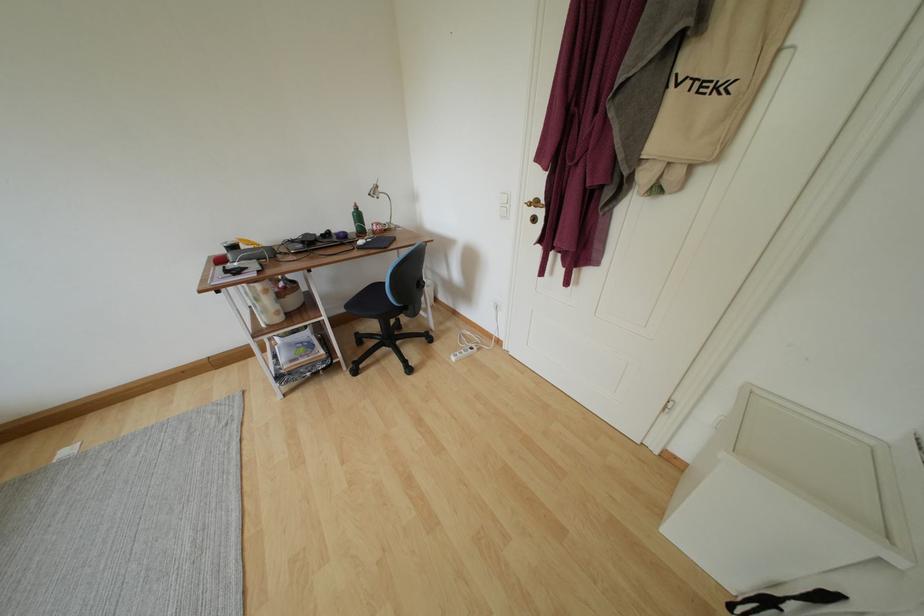
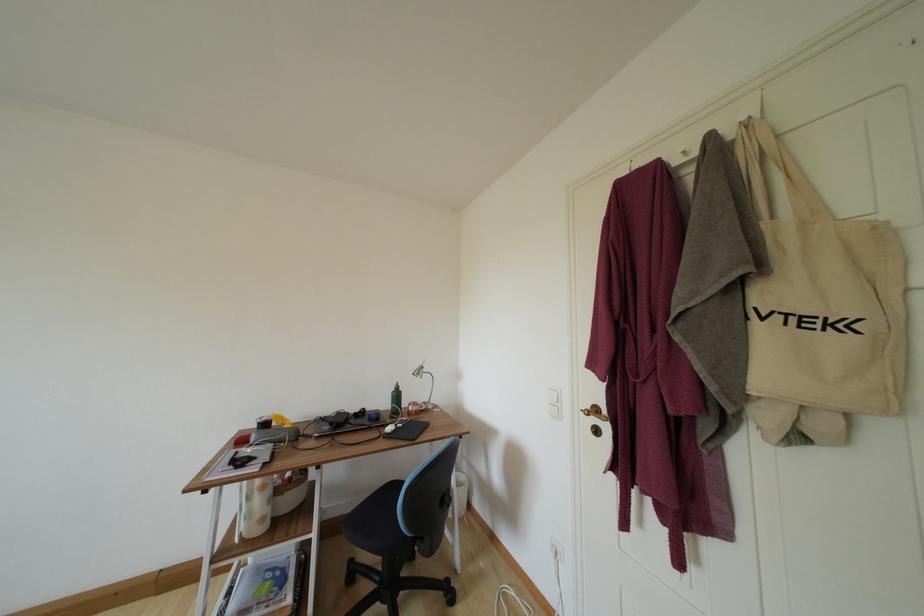
In the second image, find the point that corresponds to (283,317) in the first image.

(266, 524)